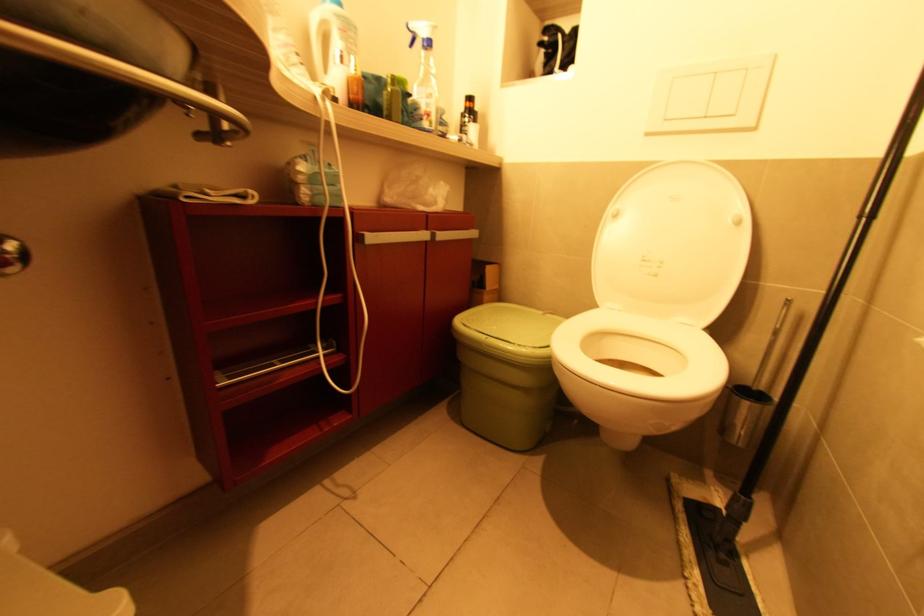
The width and height of the screenshot is (924, 616). I want to click on green bin lid, so click(506, 331).